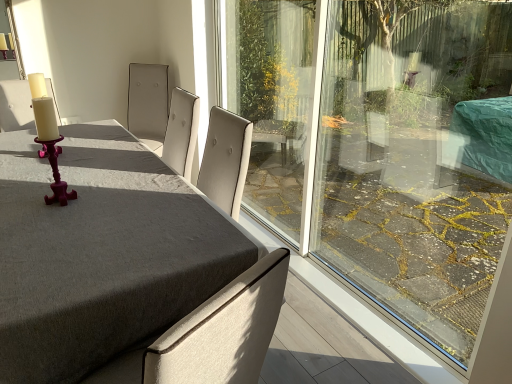
You are a GUI agent. You are given a task and a screenshot of the screen. Output one action in this format:
    pyautogui.click(x=<x>, y=<y>)
    Task: Click on the vacant space situated on the left part of matte purple candlestick at left
    This screenshot has width=512, height=384.
    Given the screenshot: What is the action you would take?
    pyautogui.click(x=22, y=198)